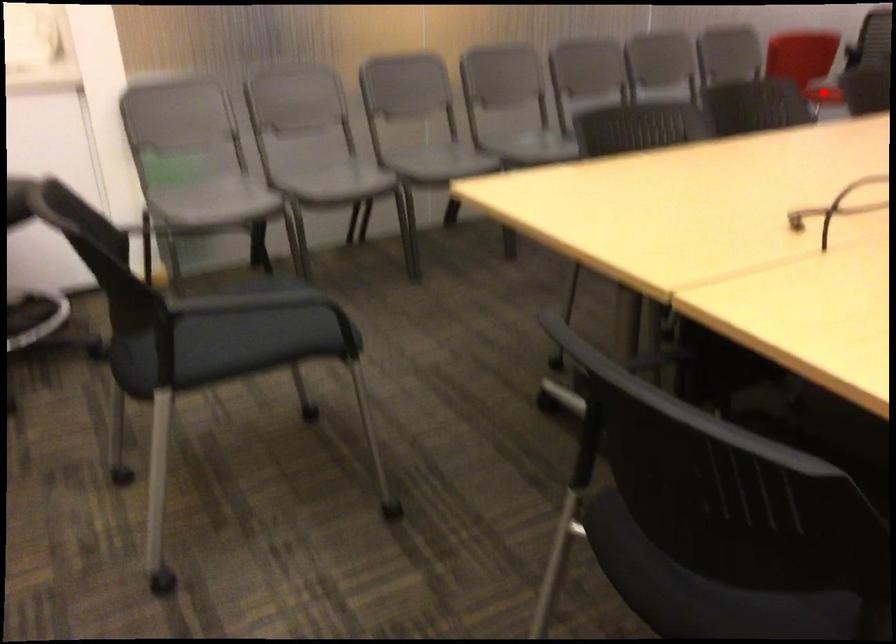
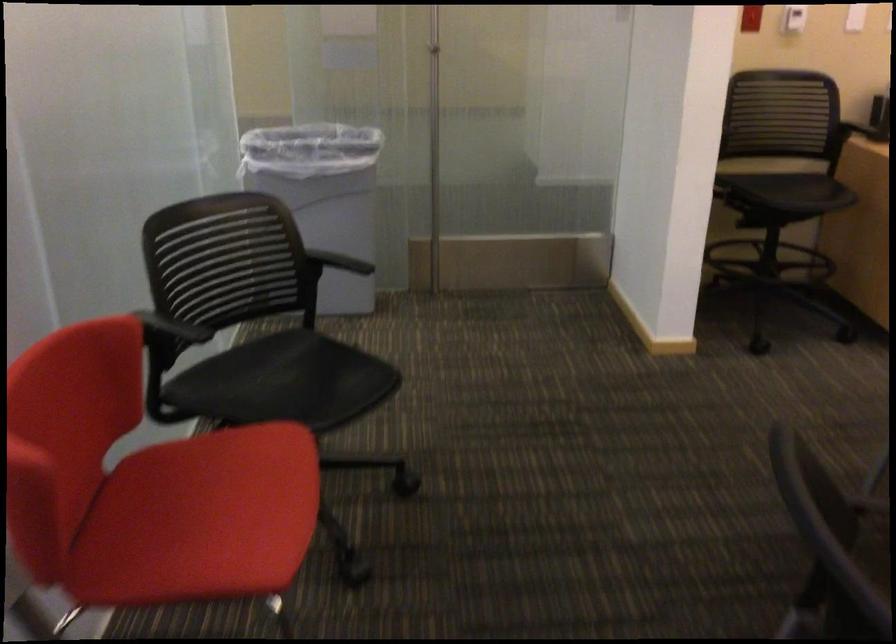
Find the pixel in the second image that matches the highlighted location in the first image.

(200, 518)